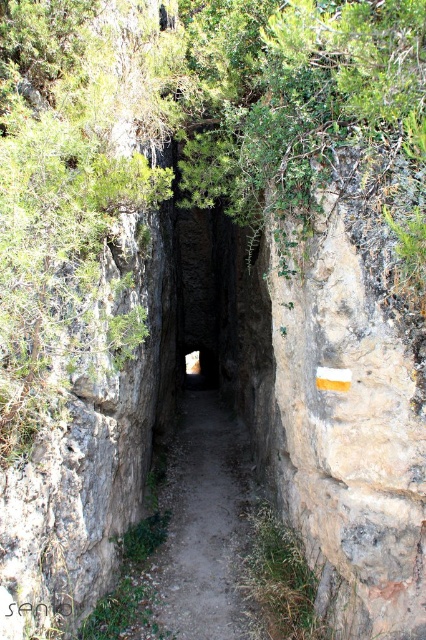
You are a hiker standing at the entrance of the narrow rocky pathway. You notice a point marked at coordinates (189, 140). What object is located at that point?

The point at coordinates (189, 140) corresponds to the green leafy tree at upper center.

You are a hiker carrying a tall backpack that is 1.8 meters in height. You come across this narrow rocky pathway. Can you pass through the dirt path at center without hitting the green leafy tree at upper center with your backpack?

The green leafy tree at upper center is taller than the dirt path at center. Since the tree is taller, the height clearance available on the path is less than the tree height. However, the exact height of the path isn

You are standing at the point marked as point (x=43, y=276) on the narrow rocky pathway. You want to toss a small pebble to your friend who is 3 meters away from you. Will the pebble reach your friend if you throw it straight ahead?

The distance between you and your friend is exactly 3.07 meters. Since you can throw the pebble 3 meters, it won not quite reach your friend.